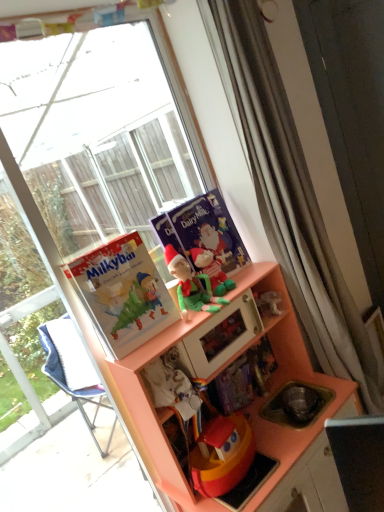
The width and height of the screenshot is (384, 512). I want to click on vacant area that is situated to the right of green plush toy at center, the second toy viewed from the front, so click(239, 274).